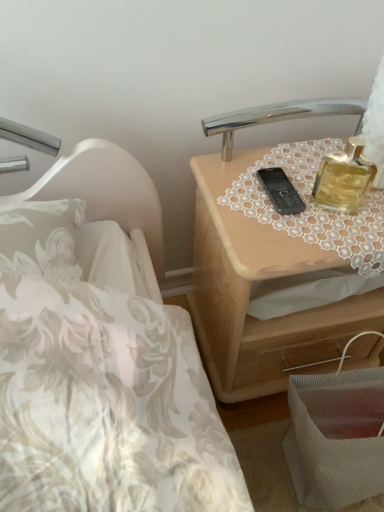
Locate an element on the screen. This screenshot has width=384, height=512. vacant point above lace fabric at upper right (from a real-world perspective) is located at coordinates (311, 185).